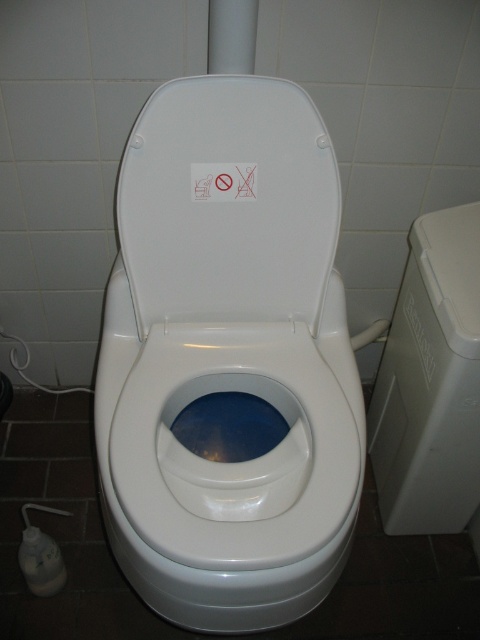
Question: Is white glossy toilet lid at center smaller than white plastic trash can at right?

Choices:
 (A) yes
 (B) no

Answer: (A)

Question: Does white glossy toilet lid at center have a larger size compared to white plastic trash can at right?

Choices:
 (A) yes
 (B) no

Answer: (B)

Question: Is white glossy toilet lid at center smaller than white plastic trash can at right?

Choices:
 (A) yes
 (B) no

Answer: (A)